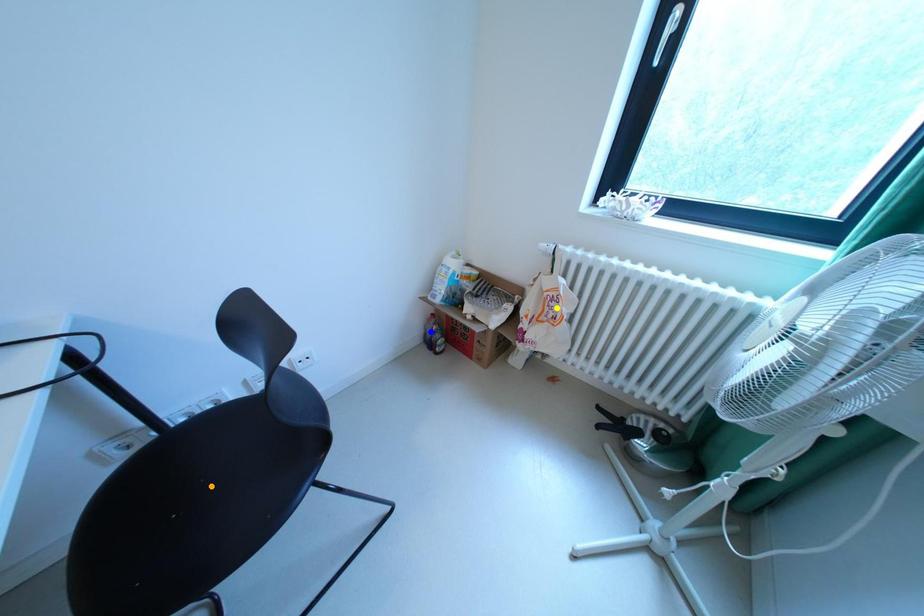
Order these from nearest to farthest:
orange point
blue point
yellow point

blue point
yellow point
orange point